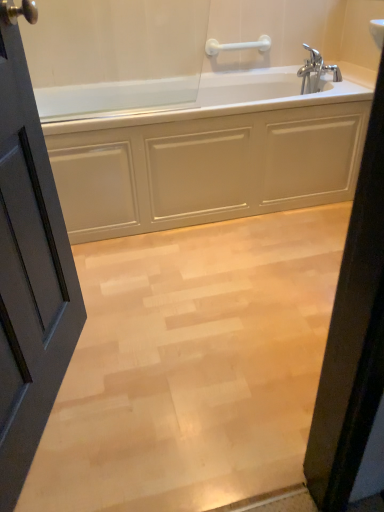
Question: Could you tell me if light wood floor at center is facing white glossy bathtub at center?

Choices:
 (A) yes
 (B) no

Answer: (B)

Question: Could white glossy bathtub at center be considered to be inside light wood floor at center?

Choices:
 (A) no
 (B) yes

Answer: (A)

Question: Considering the relative positions of light wood floor at center and white glossy bathtub at center in the image provided, is light wood floor at center to the right of white glossy bathtub at center from the viewer's perspective?

Choices:
 (A) no
 (B) yes

Answer: (B)

Question: Can you confirm if light wood floor at center is bigger than white glossy bathtub at center?

Choices:
 (A) no
 (B) yes

Answer: (A)

Question: From the image's perspective, is light wood floor at center above white glossy bathtub at center?

Choices:
 (A) no
 (B) yes

Answer: (A)

Question: Is chrome metallic faucet at upper right to the left or to the right of matte gray door at left in the image?

Choices:
 (A) right
 (B) left

Answer: (A)

Question: Relative to matte gray door at left, is chrome metallic faucet at upper right in front or behind?

Choices:
 (A) behind
 (B) front

Answer: (A)

Question: Is chrome metallic faucet at upper right spatially inside matte gray door at left, or outside of it?

Choices:
 (A) inside
 (B) outside

Answer: (B)

Question: Is point (309, 84) closer or farther from the camera than point (36, 209)?

Choices:
 (A) closer
 (B) farther

Answer: (B)

Question: From their relative heights in the image, would you say white glossy bathtub at center is taller or shorter than light wood floor at center?

Choices:
 (A) tall
 (B) short

Answer: (A)

Question: Based on their sizes in the image, would you say white glossy bathtub at center is bigger or smaller than light wood floor at center?

Choices:
 (A) small
 (B) big

Answer: (B)

Question: Considering the relative positions of white glossy bathtub at center and light wood floor at center in the image provided, is white glossy bathtub at center to the left or to the right of light wood floor at center?

Choices:
 (A) left
 (B) right

Answer: (A)

Question: From a real-world perspective, relative to light wood floor at center, is white glossy bathtub at center vertically above or below?

Choices:
 (A) above
 (B) below

Answer: (A)

Question: From a real-world perspective, relative to white glossy bathtub at center, is light wood floor at center vertically above or below?

Choices:
 (A) above
 (B) below

Answer: (B)

Question: Is light wood floor at center taller or shorter than white glossy bathtub at center?

Choices:
 (A) short
 (B) tall

Answer: (A)